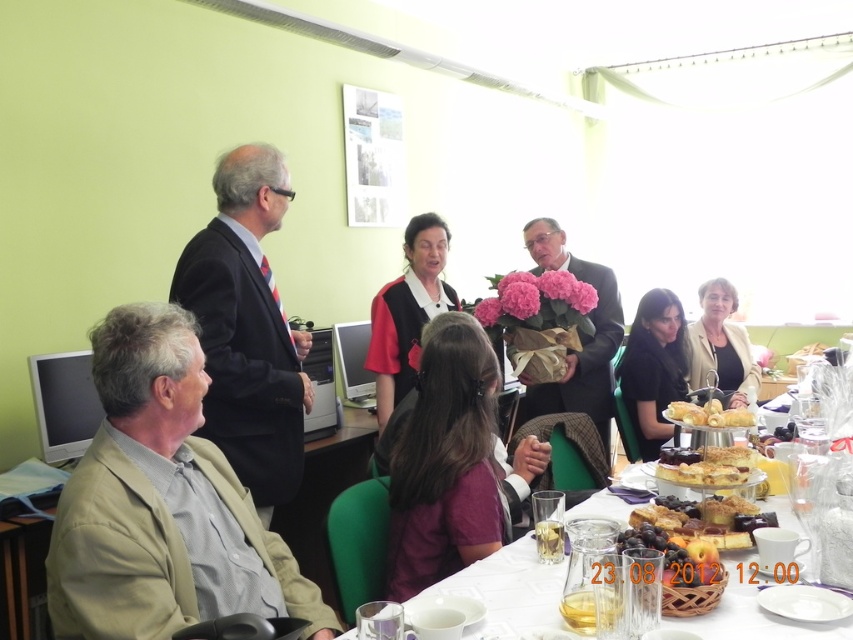
Question: Which object is positioned farthest from the black fabric dress at lower right?

Choices:
 (A) white porcelain table at lower center
 (B) purple fabric shirt at center
 (C) spongy yellow cake at lower center

Answer: (B)

Question: Which point is closer to the camera?

Choices:
 (A) spongy yellow cake at lower center
 (B) matte brown suit at center
 (C) dark suit at center
 (D) black fabric dress at lower right

Answer: (A)

Question: Which object is positioned closest to the dark suit at center?

Choices:
 (A) smooth cheese at center
 (B) light beige fabric jacket at lower right

Answer: (A)

Question: Can you confirm if matte brown suit at center is bigger than black fabric dress at lower right?

Choices:
 (A) no
 (B) yes

Answer: (B)

Question: Is purple fabric shirt at center smaller than smooth cheese at center?

Choices:
 (A) no
 (B) yes

Answer: (A)

Question: In this image, where is red fabric dress at center located relative to shiny glass grapes at lower center?

Choices:
 (A) left
 (B) right

Answer: (A)